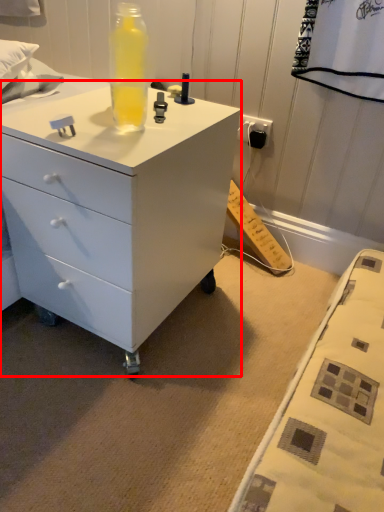
Question: From the image's perspective, where is chest of drawers (annotated by the red box) located relative to bottle?

Choices:
 (A) above
 (B) below

Answer: (B)